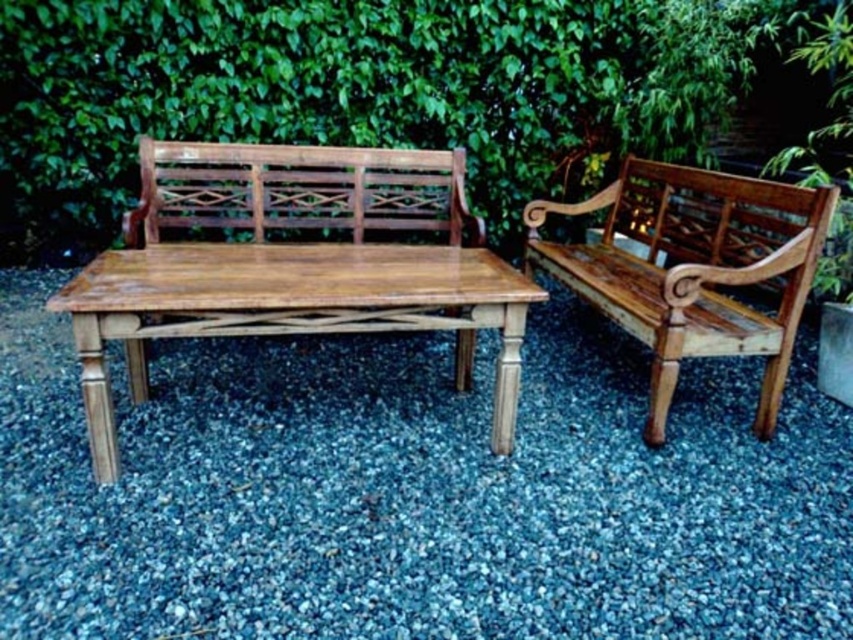
You are planning to place a small potted plant between the teak wood bench at right and the teak wood bench at center. Based on their positions, which bench should the plant be closer to?

The teak wood bench at right is below the teak wood bench at center, so the plant should be placed closer to the teak wood bench at right to maintain a balanced arrangement.

You are planning to place a new rectangular garden ornament that is 1.2 meters wide between the smooth gray gravel at center and the teak wood bench at right. Considering the space between them, will the ornament fit without overlapping either object?

The smooth gray gravel at center is wider than the teak wood bench at right. However, the exact distance between them isn not specified in the objects description. Therefore, it is uncertain if the 1.2 meter wide ornament will fit without overlapping.

You are setting up a garden party and want to arrange the light brown wood bench at center and the teak wood bench at center in a straight line. Which bench should you place first if you start from the left side of the gravel area?

You should place the teak wood bench at center first because the light brown wood bench at center is to the right of it, so starting from the left ensures they are aligned properly in a straight line.